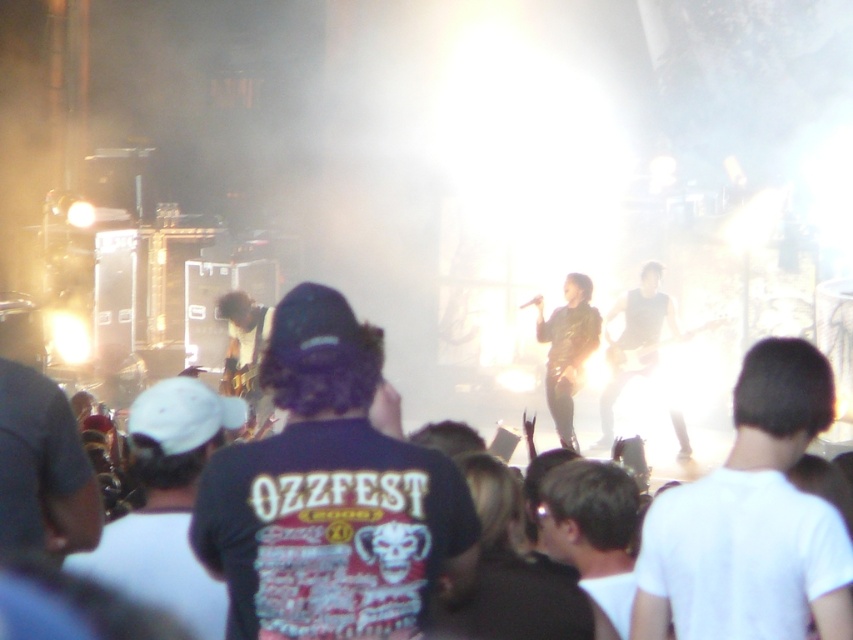
Looking at this image, is dark blue t-shirt at center smaller than white matte shirt at center?

Actually, dark blue t-shirt at center might be larger than white matte shirt at center.

How much distance is there between dark blue t-shirt at center and white matte shirt at center?

The distance of dark blue t-shirt at center from white matte shirt at center is 12.51 feet.

The image size is (853, 640). Identify the location of dark blue t-shirt at center. (328, 496).

Between dark blue t-shirt at center and shiny black guitar at center, which one has more height?

Standing taller between the two is shiny black guitar at center.

Describe the element at coordinates (328, 496) in the screenshot. The height and width of the screenshot is (640, 853). I see `dark blue t-shirt at center` at that location.

Between point (300, 436) and point (659, 365), which one is positioned behind?

Point (659, 365)

What are the coordinates of `dark blue t-shirt at center` in the screenshot? It's located at (328, 496).

Is dark brown hair at center behind shiny black guitar at center?

No, it is not.

Does dark brown hair at center have a larger size compared to shiny black guitar at center?

Incorrect, dark brown hair at center is not larger than shiny black guitar at center.

Find the location of `dark brown hair at center`. dark brown hair at center is located at coordinates [x=593, y=531].